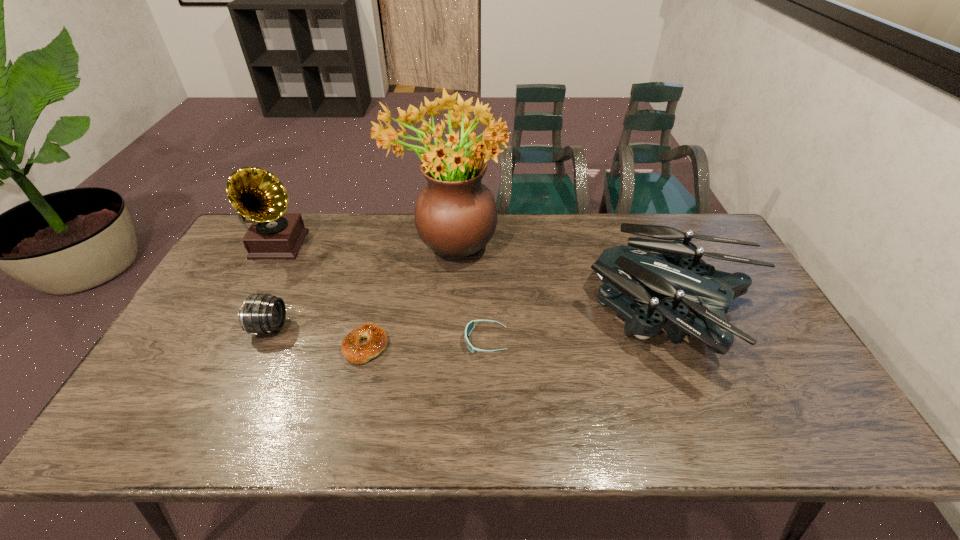
Where is `the tallest object`? This screenshot has height=540, width=960. the tallest object is located at coordinates (455, 214).

At what (x,y) coordinates should I click in order to perform the action: click on phonograph record. Please return your answer as a coordinate pair (x, y). The width and height of the screenshot is (960, 540). Looking at the image, I should click on (256, 194).

The image size is (960, 540). In order to click on drone in this screenshot , I will do `click(673, 271)`.

The width and height of the screenshot is (960, 540). I want to click on the rightmost object, so click(673, 271).

You are a GUI agent. You are given a task and a screenshot of the screen. Output one action in this format:
    pyautogui.click(x=<x>, y=<y>)
    Task: Click on the fourth tallest object
    Image resolution: width=960 pixels, height=540 pixels.
    Given the screenshot: What is the action you would take?
    pyautogui.click(x=260, y=313)

This screenshot has width=960, height=540. I want to click on goggles, so click(x=470, y=326).

Find the location of `bagel`. bagel is located at coordinates (352, 350).

Image resolution: width=960 pixels, height=540 pixels. What are the coordinates of `free location located 0.320m on the front of the flower arrangement` in the screenshot? It's located at (437, 363).

You are a GUI agent. You are given a task and a screenshot of the screen. Output one action in this format:
    pyautogui.click(x=<x>, y=<y>)
    Task: Click on the vacant space located from the horn of the second tallest object
    
    Given the screenshot: What is the action you would take?
    pyautogui.click(x=214, y=363)

Identify the location of vacant area situated 0.140m on the left of the rightmost object. (536, 317).